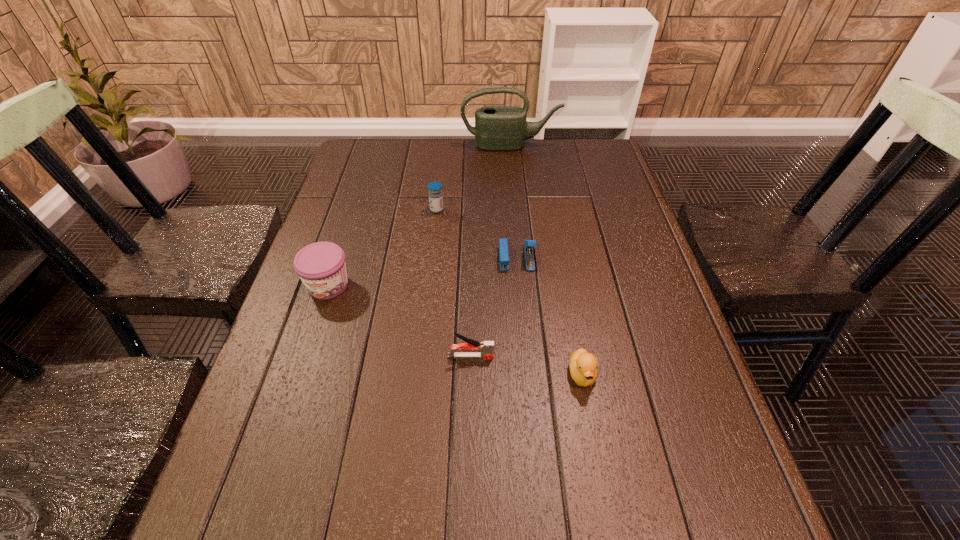
The image size is (960, 540). Identify the location of the farthest object. (500, 128).

The image size is (960, 540). I want to click on the tallest object, so click(500, 128).

At what (x,y) coordinates should I click in order to perform the action: click on the leftmost object. Please return your answer as a coordinate pair (x, y). Looking at the image, I should click on (321, 266).

This screenshot has height=540, width=960. What are the coordinates of `the fifth object from right to left` in the screenshot? It's located at [435, 188].

Identify the location of the second farthest object. The image size is (960, 540). (435, 188).

Locate an element on the screen. The height and width of the screenshot is (540, 960). the nearer stapler is located at coordinates (486, 348).

Where is `the right stapler`? This screenshot has height=540, width=960. the right stapler is located at coordinates (503, 243).

You are a GUI agent. You are given a task and a screenshot of the screen. Output one action in this format:
    pyautogui.click(x=<x>, y=<y>)
    Task: Click on the duckling
    This screenshot has width=960, height=540.
    Given the screenshot: What is the action you would take?
    pyautogui.click(x=583, y=366)

Identify the location of free region located on the spout of the watering can. [516, 201].

Identify the location of vacant region located 0.250m on the front label of the jam. (290, 401).